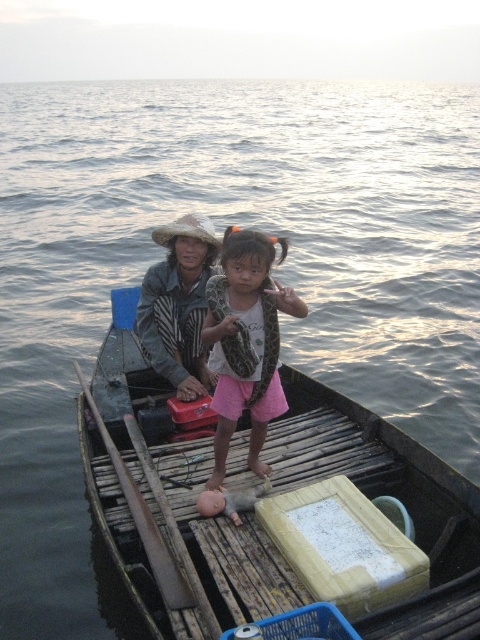
Question: Is pink fabric child at center positioned before brown wood paddle at center?

Choices:
 (A) no
 (B) yes

Answer: (A)

Question: Can you confirm if pink fabric child at center is thinner than brown wood paddle at center?

Choices:
 (A) yes
 (B) no

Answer: (A)

Question: Which object appears closest to the camera in this image?

Choices:
 (A) brown wood paddle at center
 (B) pink fabric child at center

Answer: (A)

Question: Which object is closer to the camera taking this photo?

Choices:
 (A) brown wood paddle at center
 (B) pink fabric child at center

Answer: (A)

Question: Does pink fabric child at center appear over brown wood paddle at center?

Choices:
 (A) yes
 (B) no

Answer: (A)